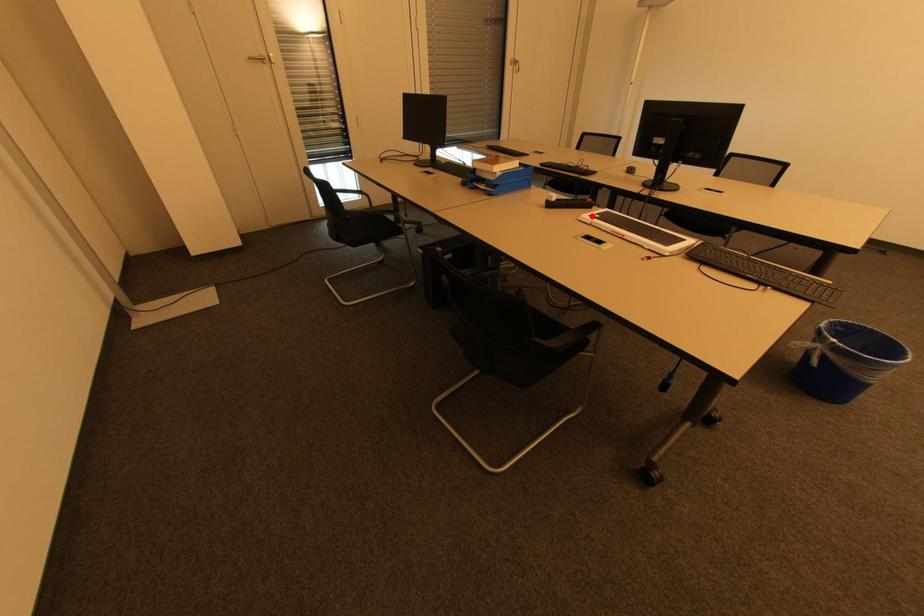
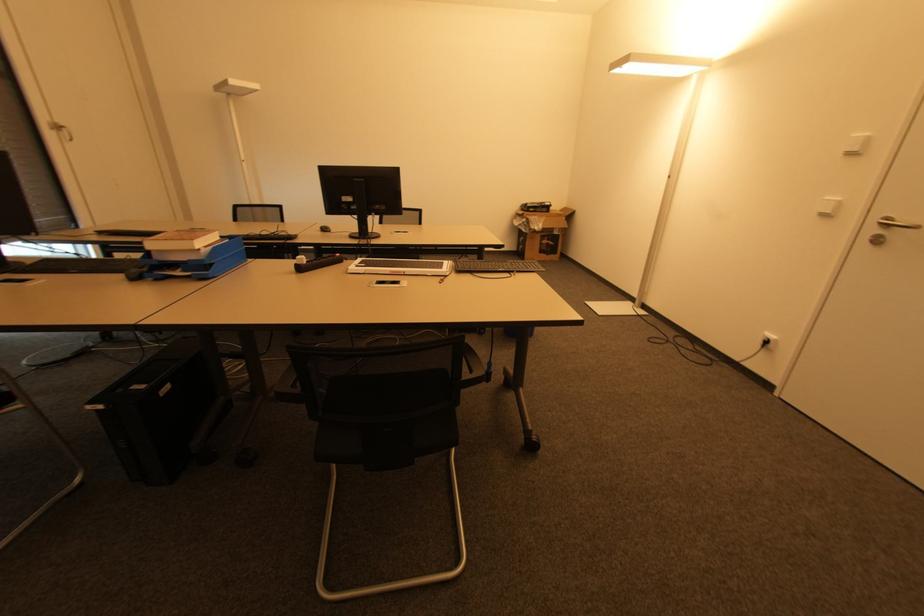
The point at the highlighted location is marked in the first image. Where is the corresponding point in the second image?

(359, 267)